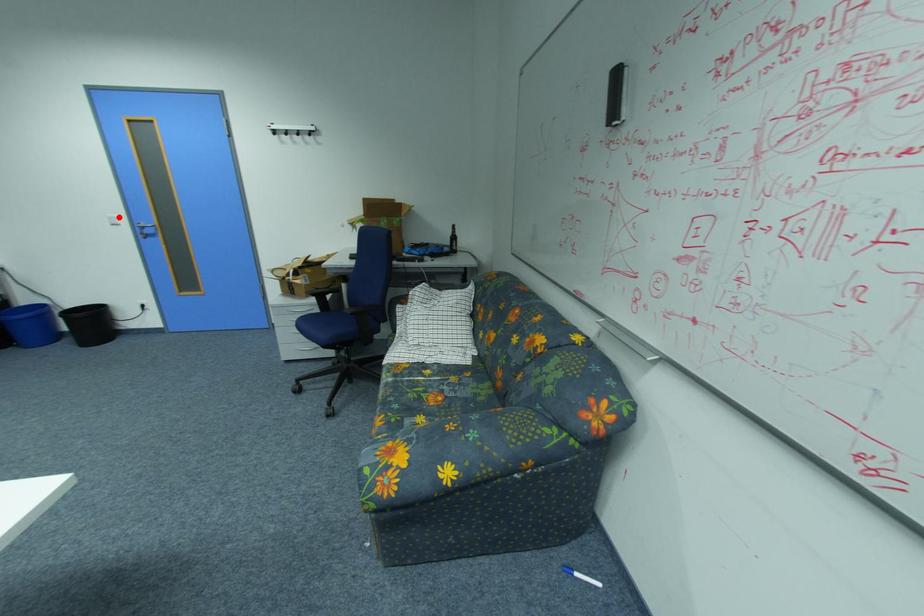
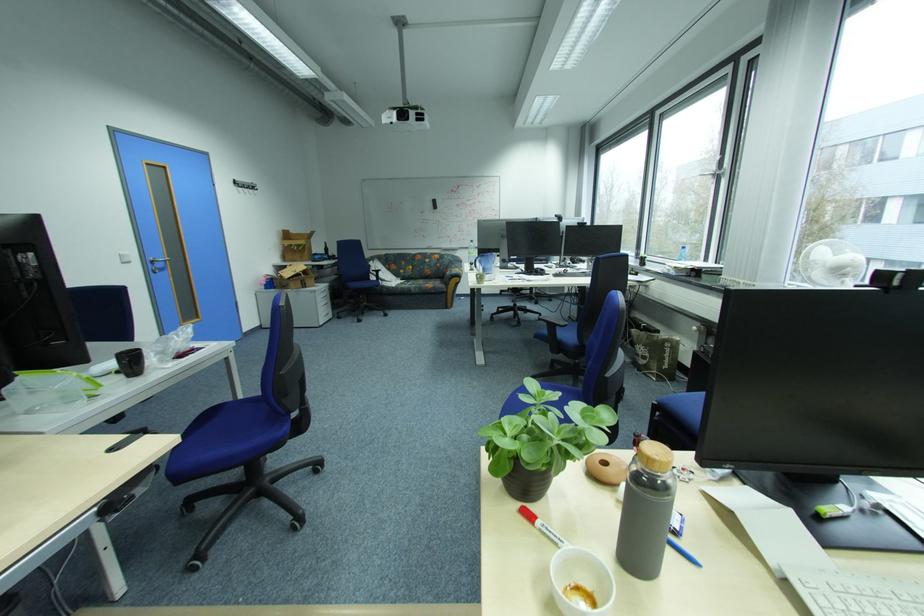
Where in the second image is the point corresponding to the highlighted location from the first image?

(130, 254)